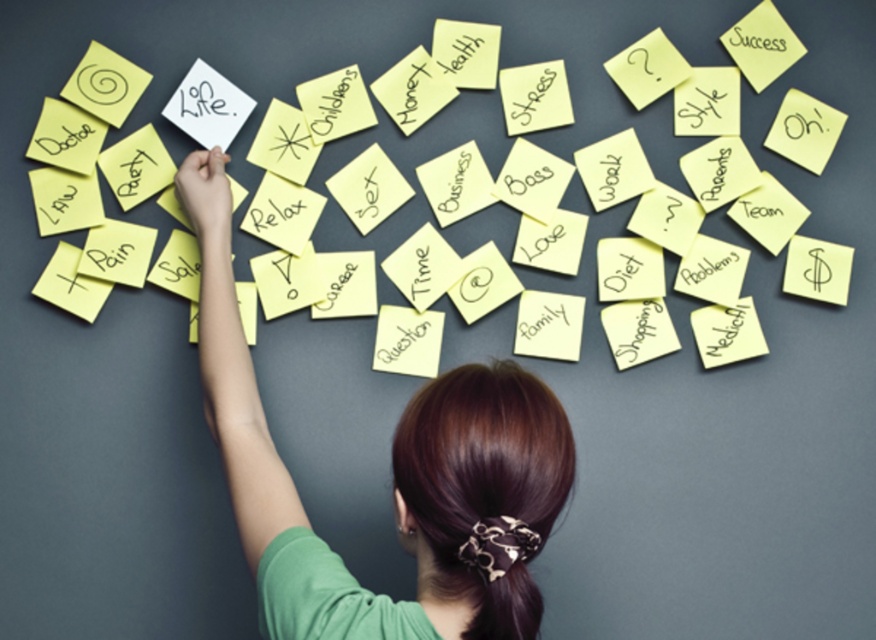
Between green fabric shirt at center and matte yellow sticky note at upper right, which one appears on the left side from the viewer's perspective?

green fabric shirt at center is more to the left.

Is green fabric shirt at center positioned before matte yellow sticky note at upper right?

Yes, it is.

Does point (507, 378) come farther from viewer compared to point (742, 29)?

That is False.

Identify the location of green fabric shirt at center. click(x=392, y=460).